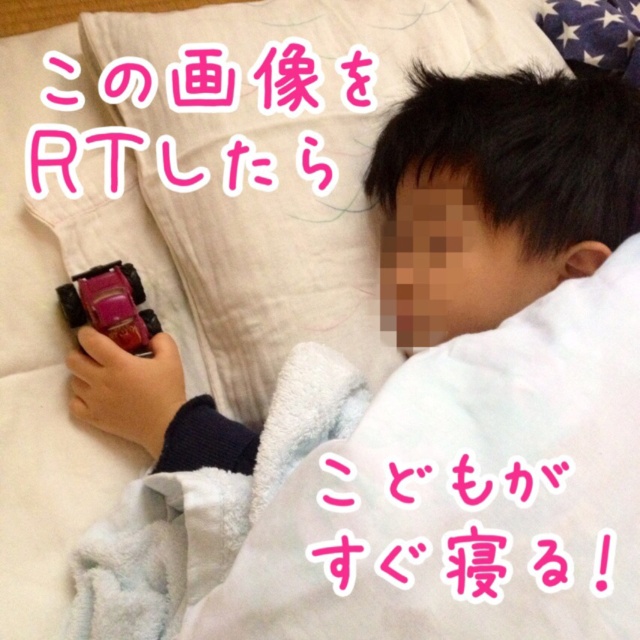
Question: Does smooth skin face at upper right have a larger size compared to shiny red car at lower left?

Choices:
 (A) yes
 (B) no

Answer: (A)

Question: Which object is farther from the camera taking this photo?

Choices:
 (A) smooth skin face at upper right
 (B) shiny red car at lower left

Answer: (B)

Question: Considering the relative positions of smooth skin face at upper right and shiny red car at lower left in the image provided, where is smooth skin face at upper right located with respect to shiny red car at lower left?

Choices:
 (A) above
 (B) below

Answer: (A)

Question: Observing the image, what is the correct spatial positioning of smooth skin face at upper right in reference to shiny red car at lower left?

Choices:
 (A) right
 (B) left

Answer: (A)